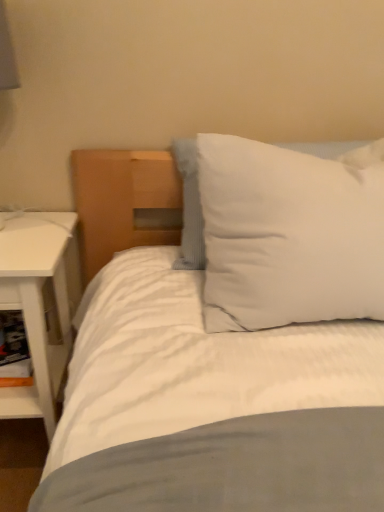
Question: From a real-world perspective, does white soft pillow at upper right stand above white cardboard shelf at lower left?

Choices:
 (A) no
 (B) yes

Answer: (B)

Question: Does white soft pillow at upper right have a lesser width compared to white cardboard shelf at lower left?

Choices:
 (A) no
 (B) yes

Answer: (A)

Question: Is white soft pillow at upper right oriented away from white cardboard shelf at lower left?

Choices:
 (A) no
 (B) yes

Answer: (A)

Question: Is white soft pillow at upper right taller than white cardboard shelf at lower left?

Choices:
 (A) no
 (B) yes

Answer: (B)

Question: Does white soft pillow at upper right have a smaller size compared to white cardboard shelf at lower left?

Choices:
 (A) no
 (B) yes

Answer: (A)

Question: From the image's perspective, is white soft pillow at upper right on white cardboard shelf at lower left?

Choices:
 (A) yes
 (B) no

Answer: (A)

Question: Is white soft pillow at upper right facing away from white matte nightstand at left?

Choices:
 (A) no
 (B) yes

Answer: (A)

Question: Is white soft pillow at upper right smaller than white matte nightstand at left?

Choices:
 (A) yes
 (B) no

Answer: (A)

Question: Does white soft pillow at upper right have a lesser width compared to white matte nightstand at left?

Choices:
 (A) yes
 (B) no

Answer: (A)

Question: From the image's perspective, is white soft pillow at upper right on white matte nightstand at left?

Choices:
 (A) no
 (B) yes

Answer: (B)

Question: Is white soft pillow at upper right shorter than white matte nightstand at left?

Choices:
 (A) no
 (B) yes

Answer: (B)

Question: From the image's perspective, is white soft pillow at upper right under white matte nightstand at left?

Choices:
 (A) yes
 (B) no

Answer: (B)

Question: From a real-world perspective, is white matte nightstand at left over white soft pillow at upper right?

Choices:
 (A) no
 (B) yes

Answer: (A)